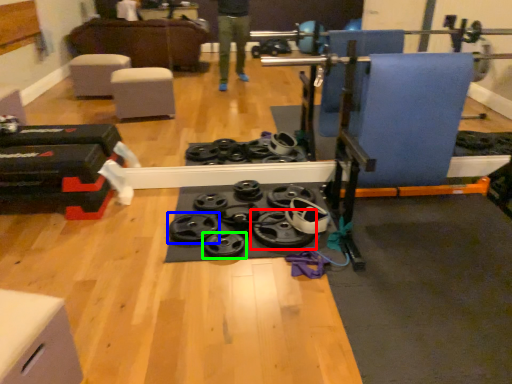
Question: Which object is the farthest from wheel (highlighted by a red box)? Choose among these: wheel (highlighted by a blue box) or wheel (highlighted by a green box).

Choices:
 (A) wheel
 (B) wheel

Answer: (A)